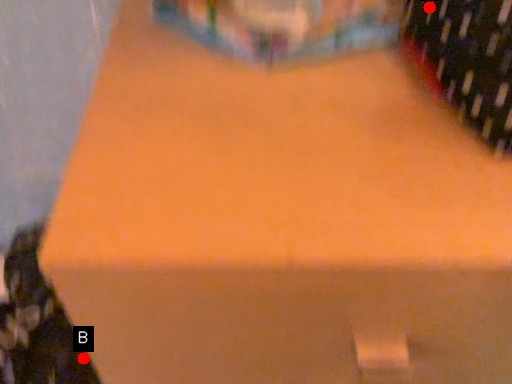
Question: Two points are circled on the image, labeled by A and B beside each circle. Which of the following is the farthest from the observer?

Choices:
 (A) A is further
 (B) B is further

Answer: (B)